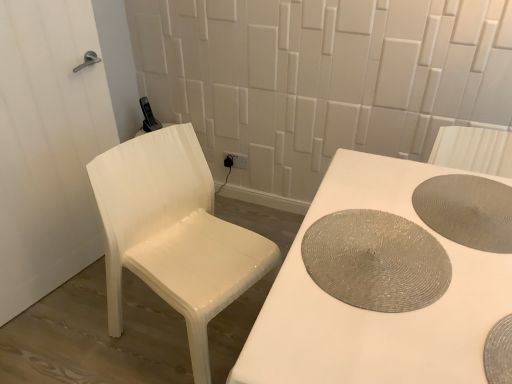
Question: Is matte gray placemat at right, the 3th manhole cover from the front, turned away from white glossy chair at left?

Choices:
 (A) yes
 (B) no

Answer: (B)

Question: Is matte gray placemat at right, the 1th manhole cover when ordered from back to front, at the left side of white glossy chair at left?

Choices:
 (A) yes
 (B) no

Answer: (B)

Question: From a real-world perspective, is matte gray placemat at right, the 3th manhole cover from the front, under white glossy chair at left?

Choices:
 (A) yes
 (B) no

Answer: (B)

Question: Is matte gray placemat at right, the 1th manhole cover when ordered from back to front, positioned far away from white glossy chair at left?

Choices:
 (A) no
 (B) yes

Answer: (A)

Question: Can you confirm if matte gray placemat at right, the 1th manhole cover when ordered from back to front, is taller than white glossy chair at left?

Choices:
 (A) yes
 (B) no

Answer: (B)

Question: From a real-world perspective, is matte gray placemat at right, the 1th manhole cover when ordered from back to front, on white glossy chair at left?

Choices:
 (A) no
 (B) yes

Answer: (B)

Question: From a real-world perspective, is white glossy door at left positioned under white glossy chair at left based on gravity?

Choices:
 (A) no
 (B) yes

Answer: (A)

Question: Is white glossy door at left taller than white glossy chair at left?

Choices:
 (A) no
 (B) yes

Answer: (B)

Question: Does white glossy door at left turn towards white glossy chair at left?

Choices:
 (A) no
 (B) yes

Answer: (B)

Question: Does white glossy door at left appear on the right side of white glossy chair at left?

Choices:
 (A) no
 (B) yes

Answer: (A)

Question: Are white glossy door at left and white glossy chair at left located far from each other?

Choices:
 (A) no
 (B) yes

Answer: (A)

Question: Considering the relative sizes of white glossy door at left and white glossy chair at left in the image provided, is white glossy door at left wider than white glossy chair at left?

Choices:
 (A) no
 (B) yes

Answer: (A)

Question: Is white glossy door at left turned away from silver textured placemat at bottom right, which is counted as the third manhole cover, starting from the back?

Choices:
 (A) no
 (B) yes

Answer: (A)